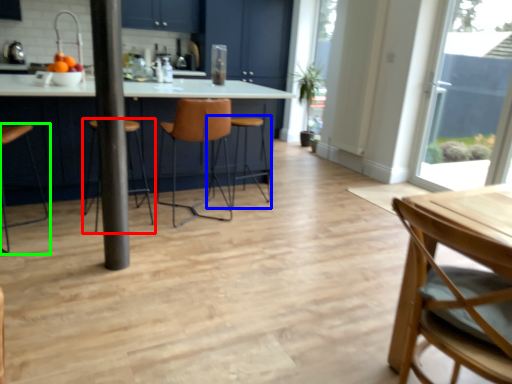
Question: Which object is positioned closest to chair (highlighted by a red box)? Select from bar stool (highlighted by a blue box) and chair (highlighted by a green box).

Choices:
 (A) bar stool
 (B) chair

Answer: (B)